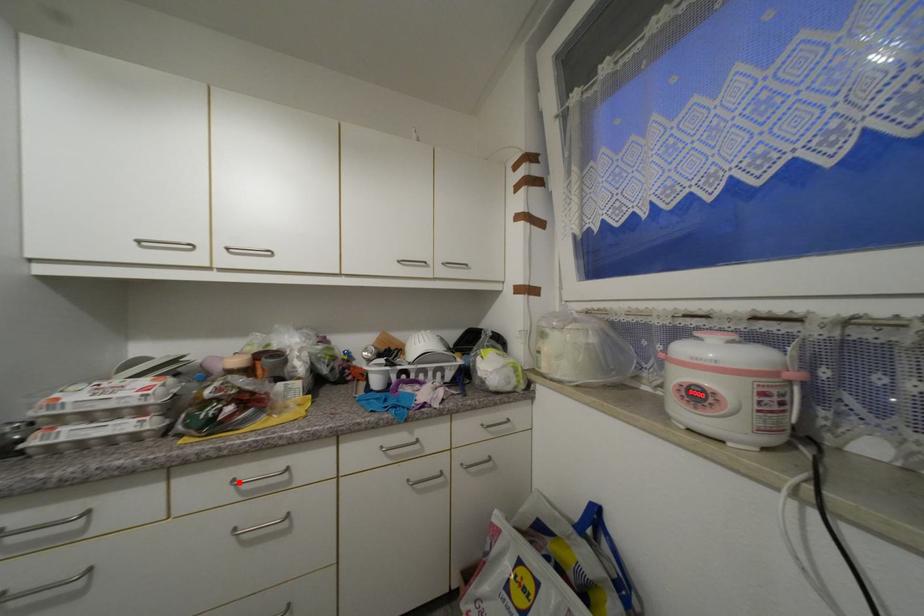
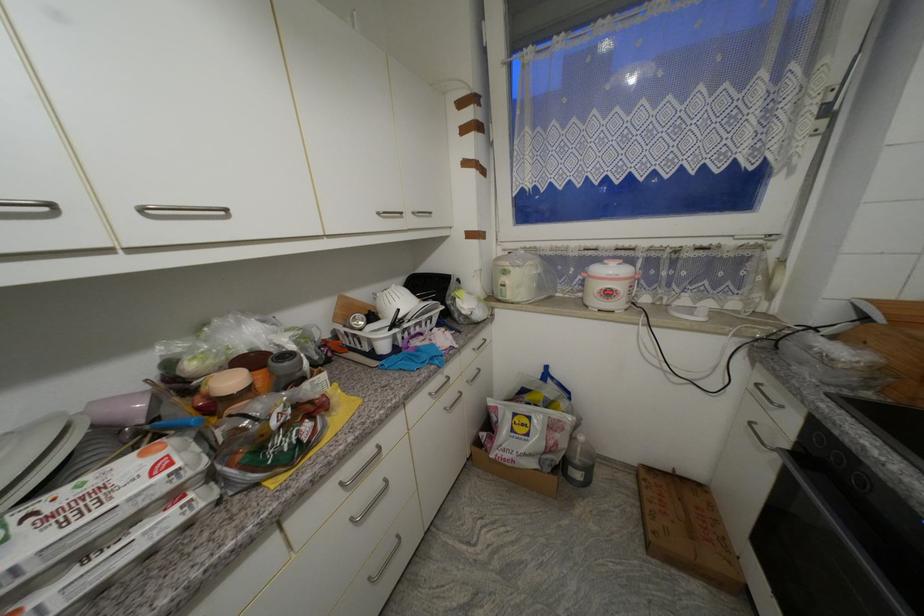
Locate, in the second image, the point that corresponds to the highlighted location in the first image.

(347, 485)